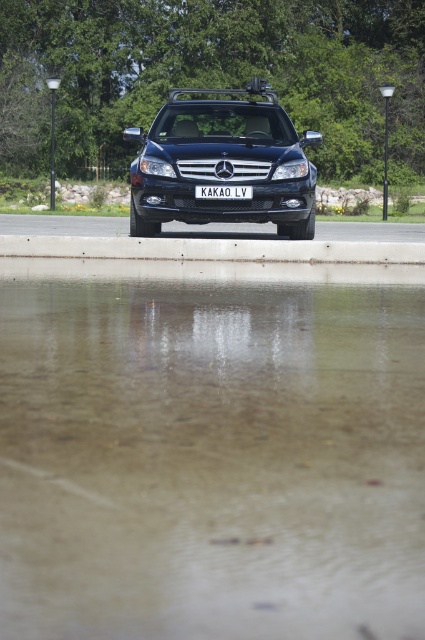
You are a delivery person trying to park your van behind the glossy black suv at center. Can you safely drive over the transparent water at lower center to reach the parking spot behind the suv?

The transparent water at lower center is in front of the glossy black suv at center, so driving over it would be necessary to reach the parking spot behind the suv. However, since the water is transparent, it might be shallow enough to drive through without causing damage to your van.

You are standing at the edge of a reflective puddle and want to place a 3 feet tall statue on the concrete at center. Will the statue be fully visible in the reflection?

The statue will be fully visible in the reflection because the concrete at center is 23.61 feet away from the camera, which is far enough for the reflection to capture objects of that height.

You are a photographer standing in front of the glossy black suv at center and the white plastic license plate at center. You want to capture a photo that shows both objects clearly. Which object should you focus on first to ensure sharpness?

The glossy black suv at center is taller than the white plastic license plate at center, so you should focus on the glossy black suv at center first to ensure sharpness.